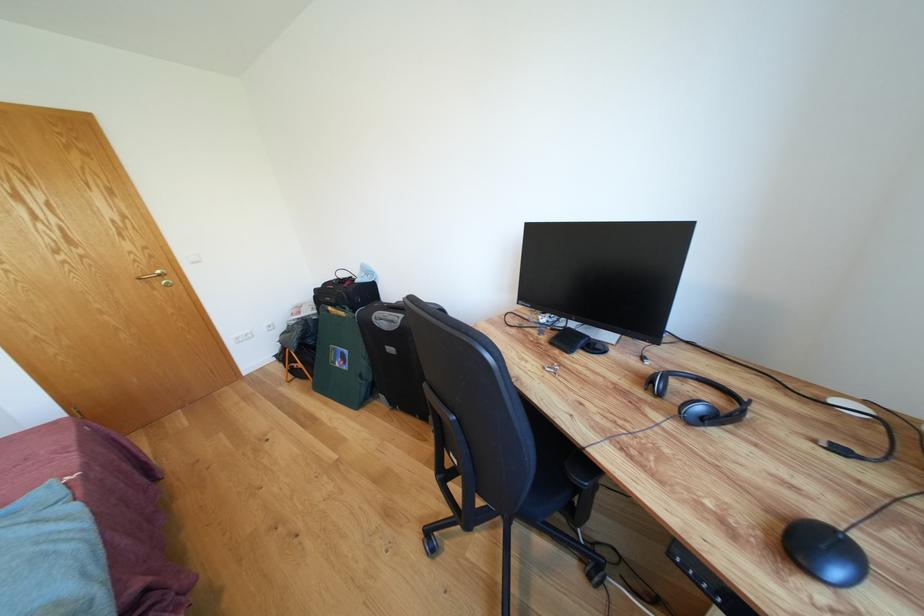
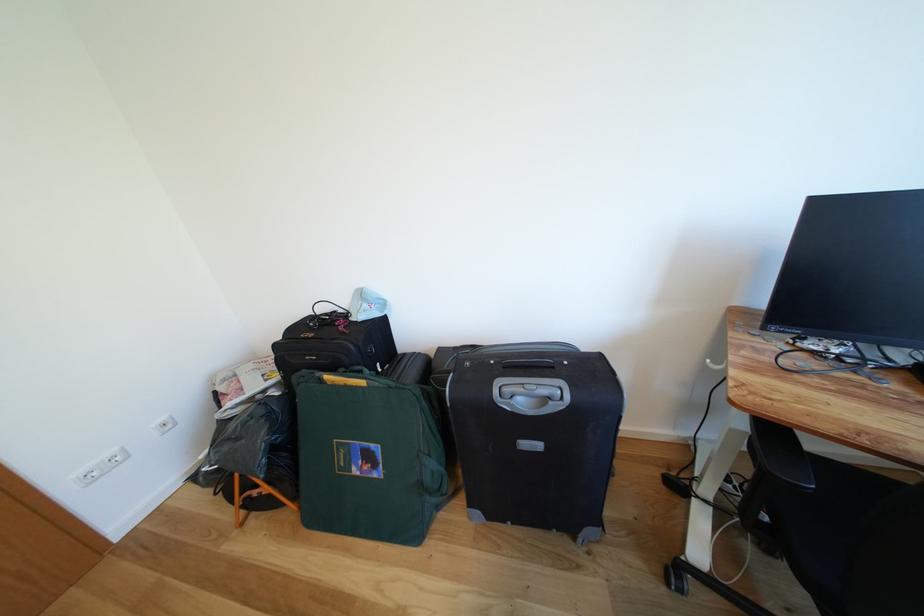
Which direction would the cameraman need to move to produce the second image?

The cameraman moved toward left, forward.